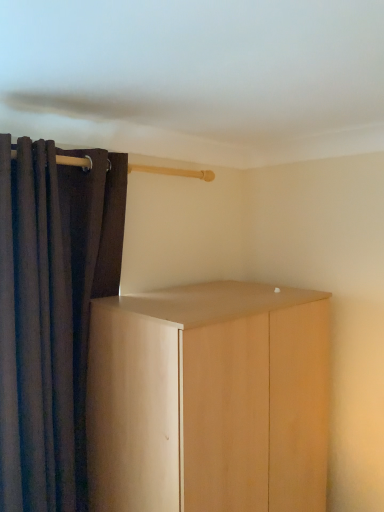
The height and width of the screenshot is (512, 384). What are the coordinates of `vacant area on top of light wood cupboard at center (from a real-world perspective)` in the screenshot? It's located at (219, 294).